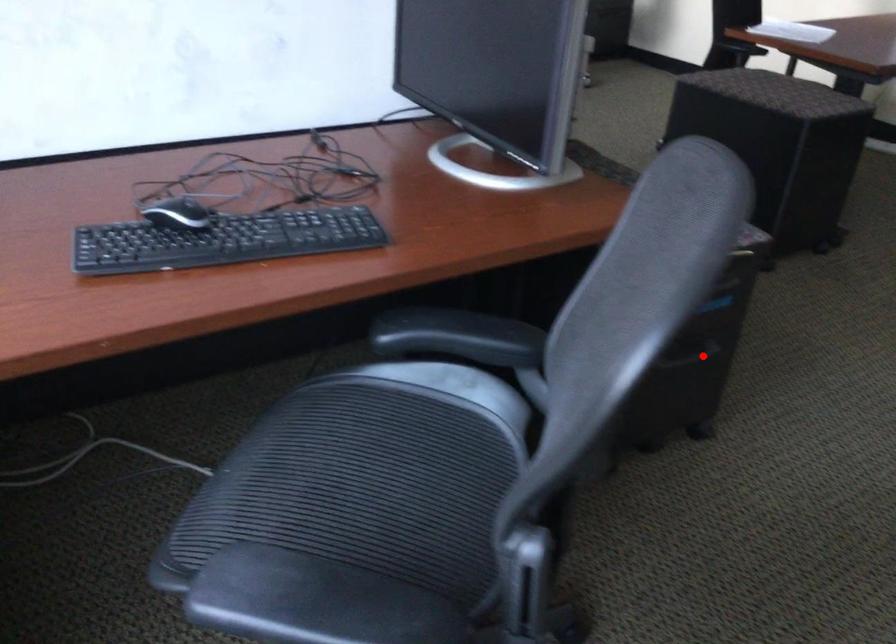
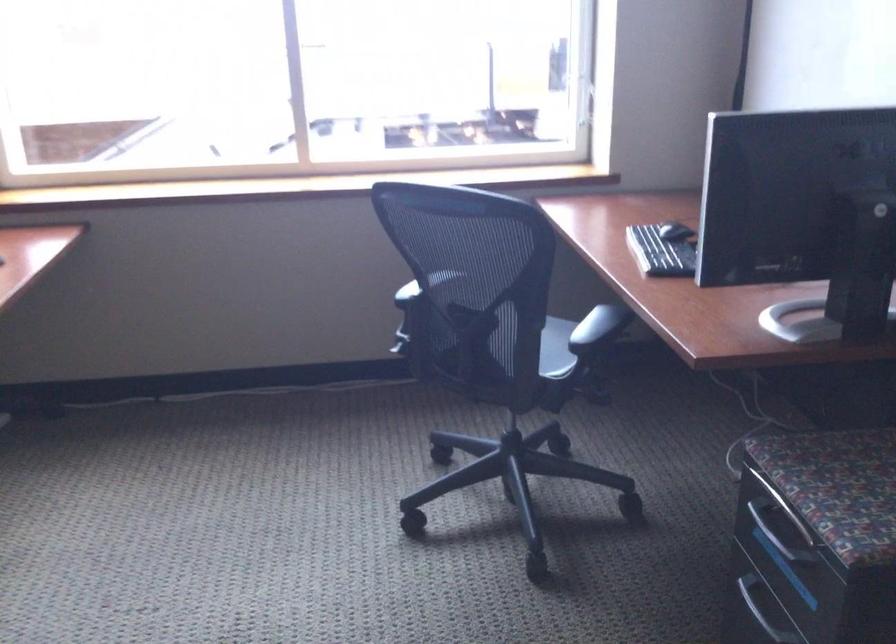
Question: I am providing you with two images of the same scene from different viewpoints. Given a red point in image1, look at the same physical point in image2. Is it:

Choices:
 (A) Closer to the viewpoint
 (B) Farther from the viewpoint

Answer: (A)